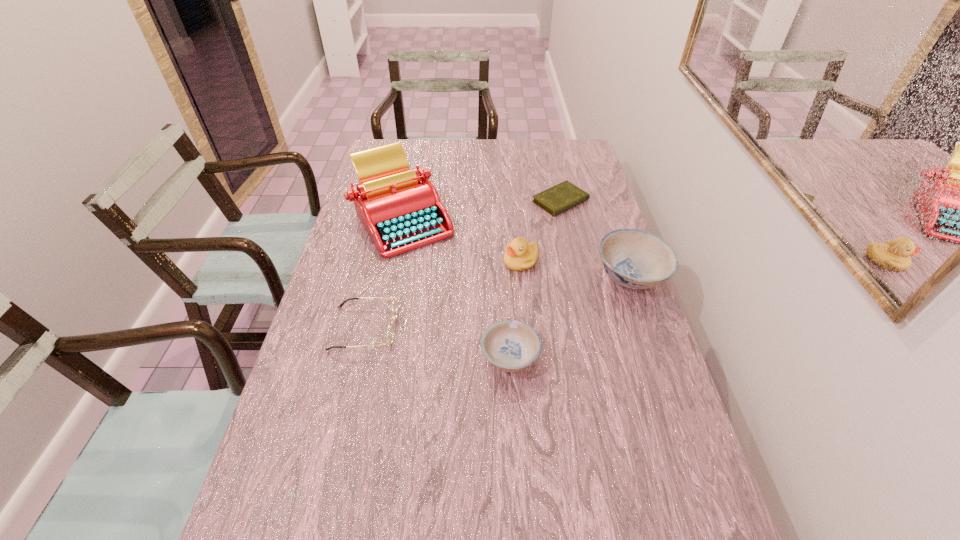
Where is `the left bowl`? The height and width of the screenshot is (540, 960). the left bowl is located at coordinates (510, 345).

Locate an element on the screen. The width and height of the screenshot is (960, 540). the shorter bowl is located at coordinates (510, 345).

In order to click on the right bowl in this screenshot , I will do `click(637, 259)`.

Where is `the farther bowl`? The image size is (960, 540). the farther bowl is located at coordinates (637, 259).

Image resolution: width=960 pixels, height=540 pixels. Identify the location of the tallest object. (399, 207).

Locate an element on the screen. The image size is (960, 540). diary is located at coordinates (563, 196).

At what (x,y) coordinates should I click in order to perform the action: click on spectacles. Please return your answer as a coordinate pair (x, y). The width and height of the screenshot is (960, 540). Looking at the image, I should click on (394, 306).

This screenshot has height=540, width=960. I want to click on duckling, so click(x=520, y=255).

The height and width of the screenshot is (540, 960). What are the coordinates of `vacant space located on the back of the left bowl` in the screenshot? It's located at (506, 295).

In order to click on free location located 0.110m on the back of the taller bowl in this screenshot , I will do `click(615, 228)`.